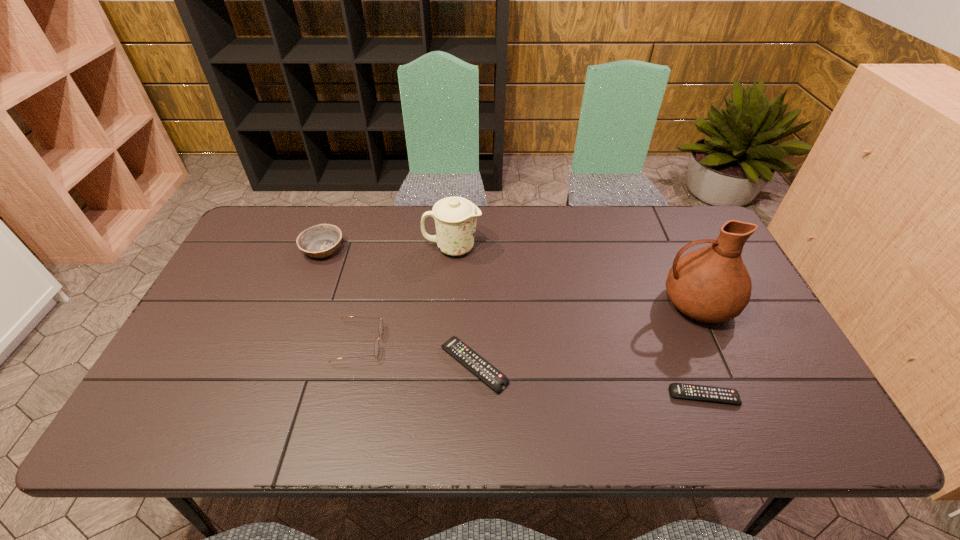
Where is `vacant space that is in between the tallest object and the chinaware`? The height and width of the screenshot is (540, 960). vacant space that is in between the tallest object and the chinaware is located at coordinates (574, 276).

Identify the location of unoccupied area between the fifth object from right to left and the leftmost object. (341, 296).

Where is `vacant region between the pitcher and the fifth object from right to left`? The height and width of the screenshot is (540, 960). vacant region between the pitcher and the fifth object from right to left is located at coordinates (528, 323).

Where is `vacant area that lies between the left remote control and the chinaware`? This screenshot has width=960, height=540. vacant area that lies between the left remote control and the chinaware is located at coordinates (464, 307).

Where is `object that is the closest one to the second tallest object`? The image size is (960, 540). object that is the closest one to the second tallest object is located at coordinates (x=320, y=241).

Identify which object is the fifth nearest to the spectacles. Please provide its 2D coordinates. Your answer should be formatted as a tuple, i.e. [(x, y)], where the tuple contains the x and y coordinates of a point satisfying the conditions above.

[(711, 284)]

Locate an element on the screen. The height and width of the screenshot is (540, 960). vacant space that satisfies the following two spatial constraints: 1. on the spout of the shortest object; 2. on the right side of the chinaware is located at coordinates (443, 396).

This screenshot has width=960, height=540. What are the coordinates of `free spot that satisfies the following two spatial constraints: 1. on the side of the pitcher with the handle; 2. on the front side of the fifth tallest object` in the screenshot? It's located at (724, 366).

At what (x,y) coordinates should I click in order to perform the action: click on vacant area in the image that satisfies the following two spatial constraints: 1. on the side of the tallest object with the handle; 2. on the front side of the shortest object. Please return your answer as a coordinate pair (x, y). This screenshot has height=540, width=960. Looking at the image, I should click on (738, 396).

The width and height of the screenshot is (960, 540). I want to click on free point that satisfies the following two spatial constraints: 1. on the temples of the spectacles; 2. on the left side of the left remote control, so click(x=354, y=366).